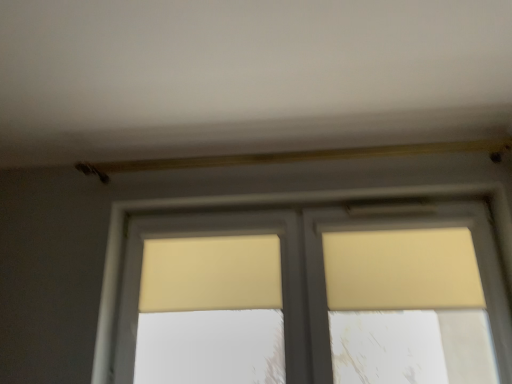
Question: Is matte yellow window at center spatially inside beige fabric curtain at upper right, the 2th curtain from the left, or outside of it?

Choices:
 (A) outside
 (B) inside

Answer: (A)

Question: Based on their positions, is matte yellow window at center located to the left or right of beige fabric curtain at upper right, which is counted as the first curtain, starting from the right?

Choices:
 (A) left
 (B) right

Answer: (A)

Question: Which object is positioned farthest from the beige fabric curtain at center, arranged as the 1th curtain when viewed from the left?

Choices:
 (A) beige fabric curtain at upper right, which is counted as the first curtain, starting from the right
 (B) matte yellow window at center

Answer: (A)

Question: Considering the real-world distances, which object is closest to the matte yellow window at center?

Choices:
 (A) beige fabric curtain at upper right, the 2th curtain from the left
 (B) beige fabric curtain at center, arranged as the 1th curtain when viewed from the left

Answer: (B)